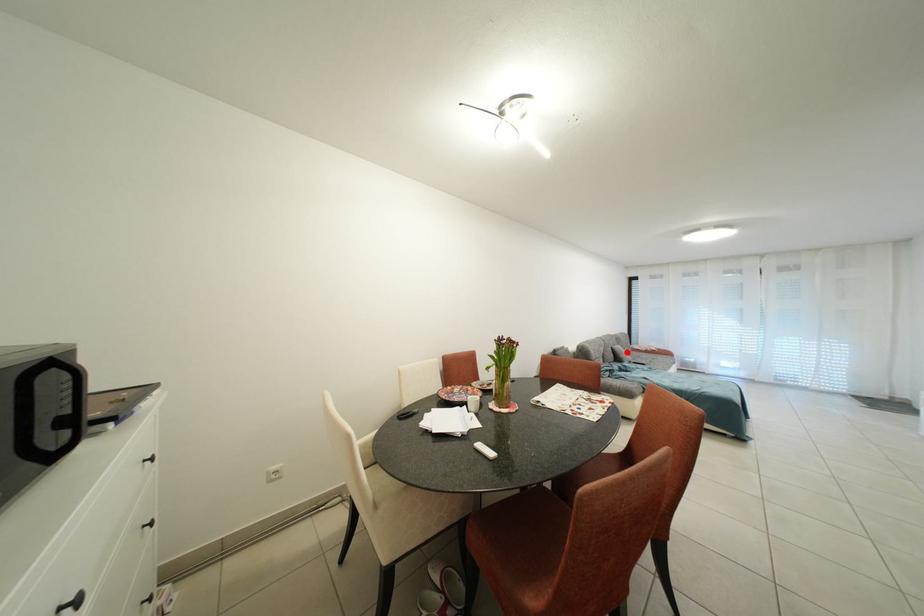
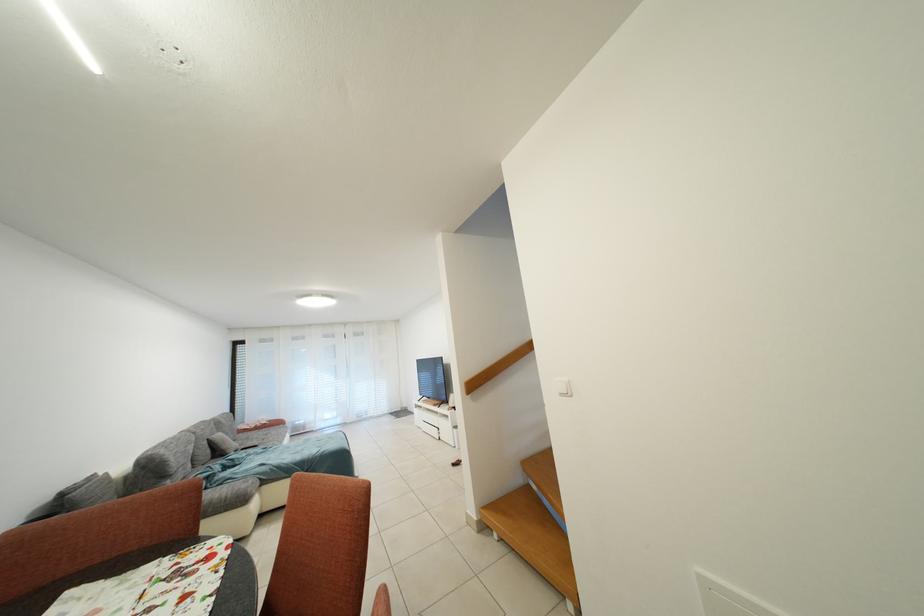
In the second image, find the point that corresponds to the highlighted location in the first image.

(227, 440)